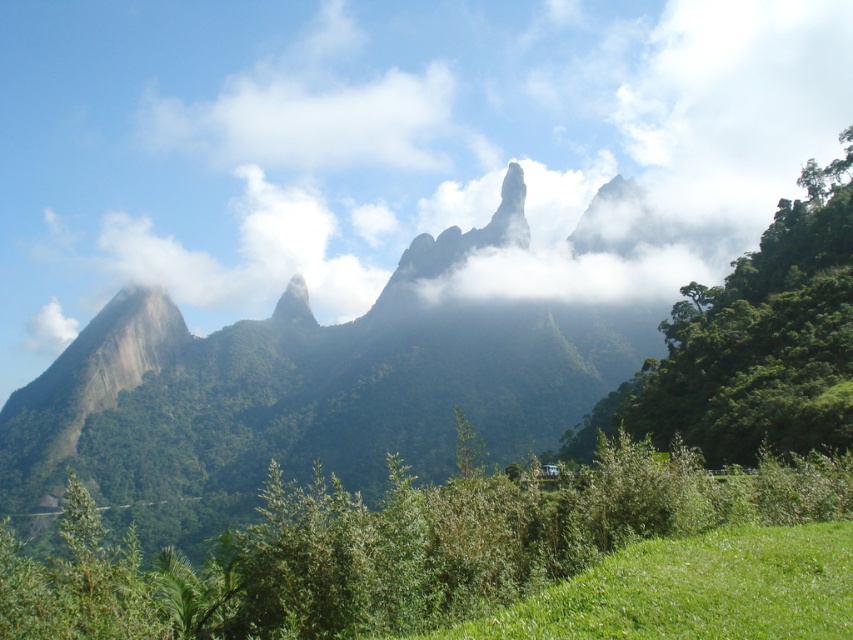
Question: Among these points, which one is farthest from the camera?

Choices:
 (A) (654, 129)
 (B) (305, 285)

Answer: (A)

Question: Observing the image, what is the correct spatial positioning of white fluffy cloud at upper center in reference to smooth granite peak at center?

Choices:
 (A) left
 (B) right

Answer: (B)

Question: Is white fluffy cloud at upper center further to camera compared to smooth granite peak at center?

Choices:
 (A) yes
 (B) no

Answer: (B)

Question: In this image, where is white fluffy cloud at upper center located relative to smooth granite peak at center?

Choices:
 (A) below
 (B) above

Answer: (B)

Question: Which of the following is the closest to the observer?

Choices:
 (A) [262, 67]
 (B) [280, 314]

Answer: (B)